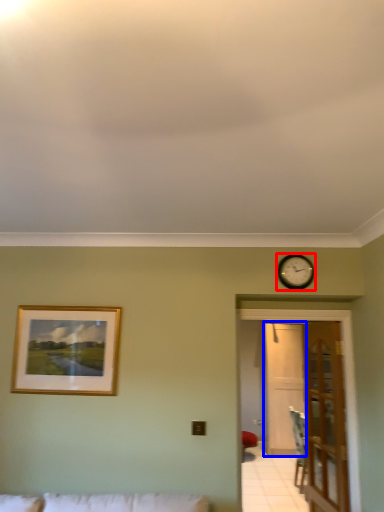
Question: Which object is further to the camera taking this photo, wall clock (highlighted by a red box) or glass door (highlighted by a blue box)?

Choices:
 (A) wall clock
 (B) glass door

Answer: (B)